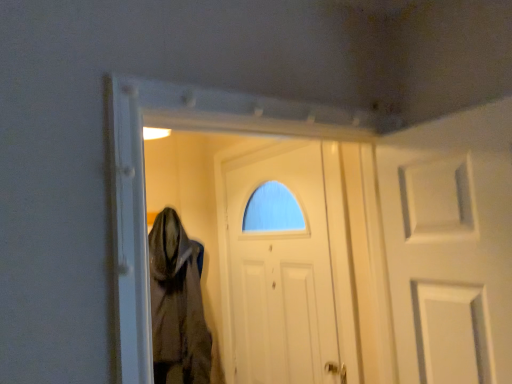
Question: Considering the positions of brown textured cloth at center and white matte door at center in the image, is brown textured cloth at center wider or thinner than white matte door at center?

Choices:
 (A) thin
 (B) wide

Answer: (B)

Question: Is point click(x=169, y=210) closer or farther from the camera than point click(x=274, y=215)?

Choices:
 (A) farther
 (B) closer

Answer: (A)

Question: From the image's perspective, is brown textured cloth at center above or below white matte door at center?

Choices:
 (A) below
 (B) above

Answer: (A)

Question: Looking at the image, does white matte door at center seem bigger or smaller compared to brown textured cloth at center?

Choices:
 (A) small
 (B) big

Answer: (B)

Question: From a real-world perspective, is white matte door at center physically located above or below brown textured cloth at center?

Choices:
 (A) below
 (B) above

Answer: (B)

Question: Considering the positions of white matte door at center and brown textured cloth at center in the image, is white matte door at center taller or shorter than brown textured cloth at center?

Choices:
 (A) short
 (B) tall

Answer: (B)

Question: In the image, is white matte door at center on the left side or the right side of brown textured cloth at center?

Choices:
 (A) left
 (B) right

Answer: (B)